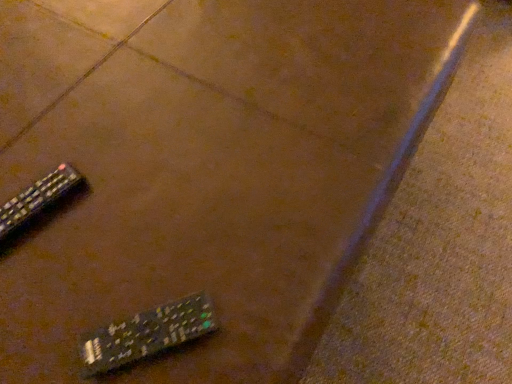
Question: Is black plastic remote at lower left, arranged as the first remote control when viewed from the right, positioned far away from black plastic remote at lower left, the 1th remote control positioned from the top?

Choices:
 (A) yes
 (B) no

Answer: (B)

Question: Considering the relative sizes of black plastic remote at lower left, arranged as the first remote control when viewed from the right, and black plastic remote at lower left, the 2th remote control viewed from the right, in the image provided, is black plastic remote at lower left, arranged as the first remote control when viewed from the right, bigger than black plastic remote at lower left, the 2th remote control viewed from the right,?

Choices:
 (A) no
 (B) yes

Answer: (B)

Question: From the image's perspective, is black plastic remote at lower left, arranged as the 2th remote control when viewed from the back, above black plastic remote at lower left, which is the second remote control from front to back?

Choices:
 (A) yes
 (B) no

Answer: (B)

Question: Is black plastic remote at lower left, arranged as the 2th remote control when viewed from the back, behind black plastic remote at lower left, which is the second remote control from front to back?

Choices:
 (A) no
 (B) yes

Answer: (A)

Question: Does black plastic remote at lower left, arranged as the 2th remote control when viewed from the back, have a greater height compared to black plastic remote at lower left, which is the 2th remote control in bottom-to-top order?

Choices:
 (A) no
 (B) yes

Answer: (B)

Question: Is black plastic remote at lower left, the first remote control positioned from the front, directly adjacent to black plastic remote at lower left, the 1th remote control positioned from the top?

Choices:
 (A) yes
 (B) no

Answer: (B)

Question: Is black plastic remote at lower left, the 1th remote control in the left-to-right sequence, to the left of black plastic remote at lower left, the 2th remote control positioned from the top, from the viewer's perspective?

Choices:
 (A) yes
 (B) no

Answer: (A)

Question: Is black plastic remote at lower left, which is the 2th remote control in bottom-to-top order, completely or partially outside of black plastic remote at lower left, the 2th remote control positioned from the top?

Choices:
 (A) yes
 (B) no

Answer: (A)

Question: Are black plastic remote at lower left, which is the 2th remote control in bottom-to-top order, and black plastic remote at lower left, arranged as the first remote control when viewed from the right, making contact?

Choices:
 (A) yes
 (B) no

Answer: (B)

Question: From a real-world perspective, is black plastic remote at lower left, which is the 2th remote control in bottom-to-top order, below black plastic remote at lower left, arranged as the 2th remote control when viewed from the back?

Choices:
 (A) yes
 (B) no

Answer: (A)

Question: Is black plastic remote at lower left, the 1th remote control positioned from the top, far from black plastic remote at lower left, the first remote control positioned from the front?

Choices:
 (A) yes
 (B) no

Answer: (B)

Question: From the image's perspective, is black plastic remote at lower left, the 2th remote control viewed from the right, below black plastic remote at lower left, the first remote control positioned from the front?

Choices:
 (A) no
 (B) yes

Answer: (A)

Question: In the image, is black plastic remote at lower left, the 1th remote control in the left-to-right sequence, positioned in front of or behind black plastic remote at lower left, arranged as the first remote control when viewed from the right?

Choices:
 (A) front
 (B) behind

Answer: (B)